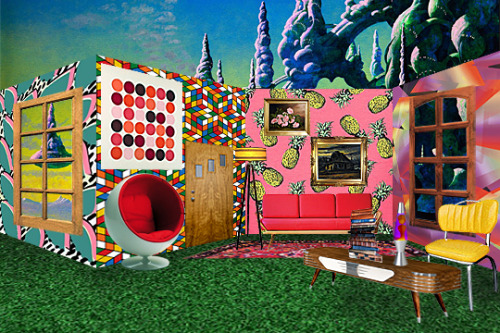
Where is `table`? table is located at coordinates (389, 271).